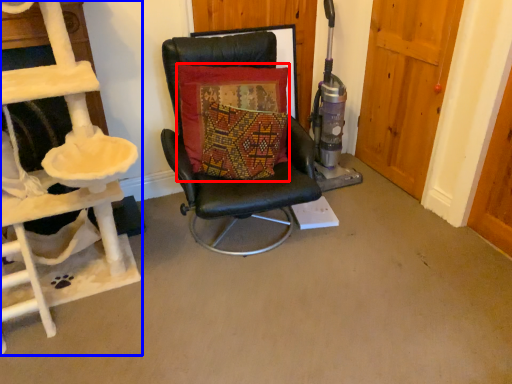
Question: Which object is closer to the camera taking this photo, pillow (highlighted by a red box) or ladder (highlighted by a blue box)?

Choices:
 (A) pillow
 (B) ladder

Answer: (B)